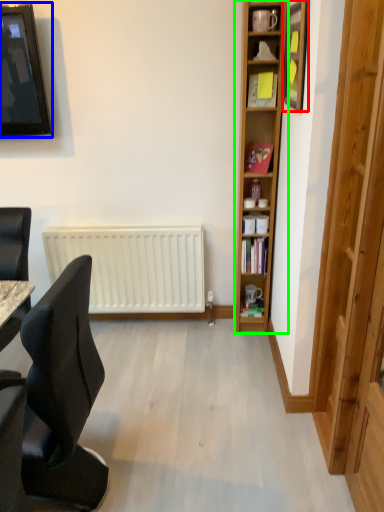
Question: Considering the real-world distances, which object is farthest from picture frame (highlighted by a red box)? television (highlighted by a blue box) or bookcase (highlighted by a green box)?

Choices:
 (A) television
 (B) bookcase

Answer: (A)